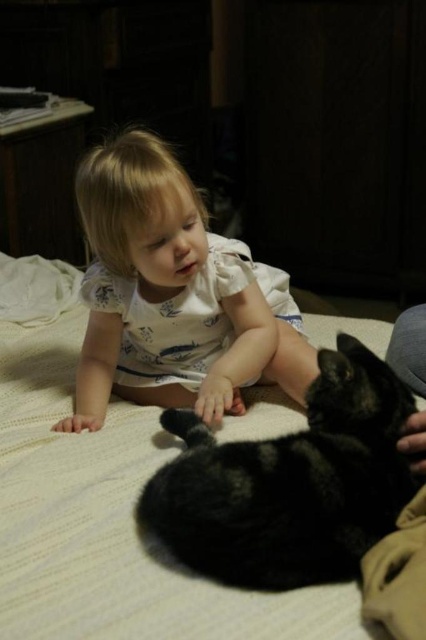
You are a toy mouse that is 10 cm long. You want to place yourself on the white soft bed at center so that you can be easily found by the black fur cat at lower center. Where should you position yourself?

The white soft bed at center is wider than the black fur cat at lower center, so placing the toy mouse in the center of the white soft bed at center would ensure it is easily accessible to the cat.

Based on the scene described, which object is taller between the white cotton toddler at center and the black fur cat at lower center?

The white cotton toddler at center is taller than the black fur cat at lower center according to the description.